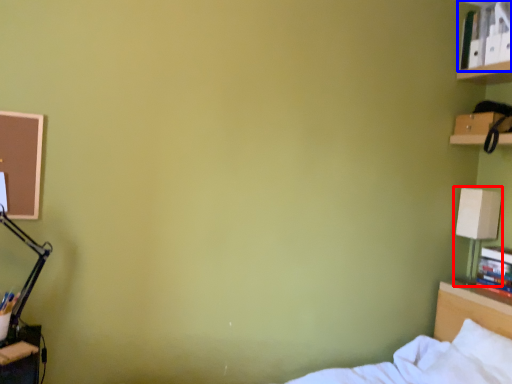
Question: Which of the following is the farthest to the observer, table lamp (highlighted by a red box) or book (highlighted by a blue box)?

Choices:
 (A) table lamp
 (B) book

Answer: (A)